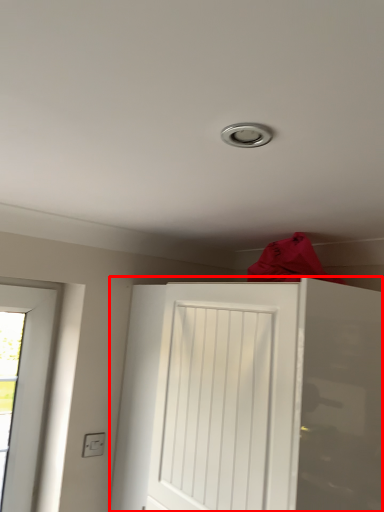
Question: Observing the image, what is the correct spatial positioning of door (annotated by the red box) in reference to electric outlet?

Choices:
 (A) left
 (B) right

Answer: (B)